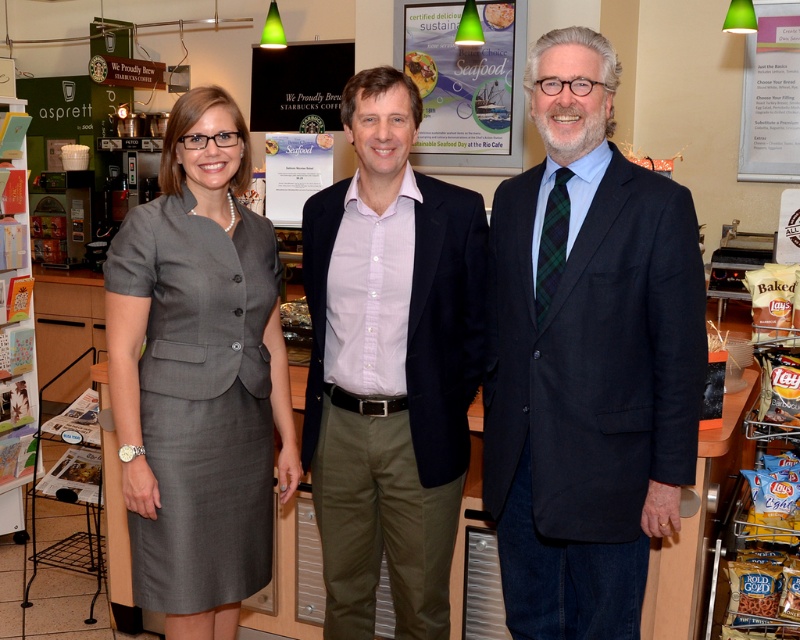
Can you confirm if matte gray dress at left is smaller than matte paper poster at center?

Actually, matte gray dress at left might be larger than matte paper poster at center.

In the scene shown: Can you confirm if matte gray dress at left is wider than matte paper poster at center?

Yes, matte gray dress at left is wider than matte paper poster at center.

Who is more forward, (606, 132) or (454, 93)?

Point (606, 132) is in front.

Where is `matte gray dress at left`? matte gray dress at left is located at coordinates (588, 358).

Is point (344, 253) positioned in front of point (204, 339)?

That is False.

Is the position of pink button-down shirt at center more distant than that of gray fabric dress at left?

That is False.

Locate an element on the screen. pink button-down shirt at center is located at coordinates (389, 365).

The width and height of the screenshot is (800, 640). Find the location of `pink button-down shirt at center`. pink button-down shirt at center is located at coordinates (389, 365).

Who is taller, matte gray dress at left or dark blue suit at center?

matte gray dress at left

Is point (504, 468) positioned after point (660, 288)?

Yes, point (504, 468) is farther from viewer.

This screenshot has height=640, width=800. What do you see at coordinates (588, 358) in the screenshot?
I see `matte gray dress at left` at bounding box center [588, 358].

The image size is (800, 640). I want to click on matte gray dress at left, so click(x=588, y=358).